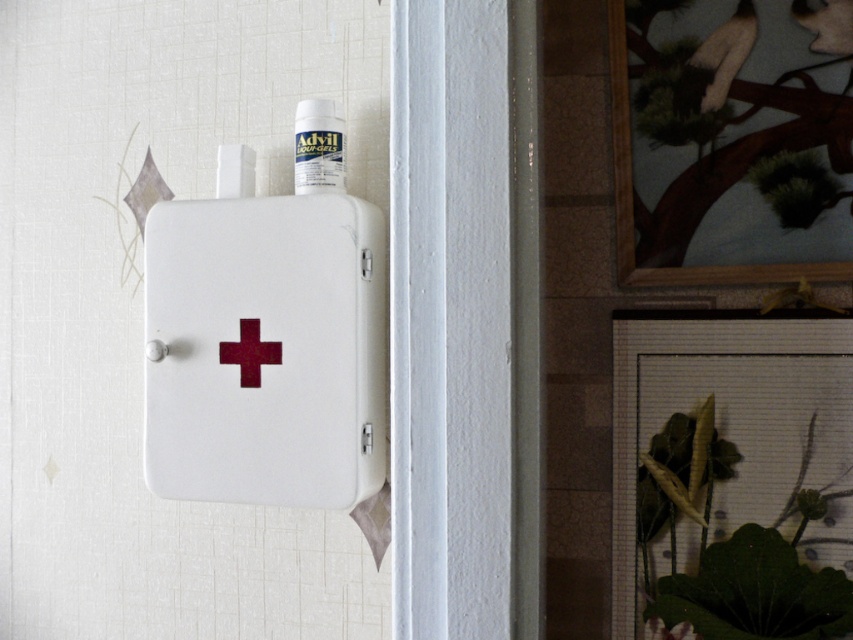
Can you confirm if white matte first aid box at center is shorter than maroon matte cross at center?

Incorrect, white matte first aid box at center's height does not fall short of maroon matte cross at center's.

This screenshot has height=640, width=853. What do you see at coordinates (265, 349) in the screenshot?
I see `white matte first aid box at center` at bounding box center [265, 349].

This screenshot has width=853, height=640. Find the location of `white matte first aid box at center`. white matte first aid box at center is located at coordinates (265, 349).

Which is in front, point (292, 492) or point (294, 131)?

Point (292, 492) is more forward.

Is point (144, 266) positioned in front of point (322, 113)?

No, it is behind (322, 113).

This screenshot has height=640, width=853. Find the location of `white matte first aid box at center`. white matte first aid box at center is located at coordinates (265, 349).

Which is in front, point (310, 102) or point (245, 387)?

Point (245, 387)

You are a GUI agent. You are given a task and a screenshot of the screen. Output one action in this format:
    pyautogui.click(x=<x>, y=<y>)
    Task: Click on the white plastic bottle at upper center
    The height and width of the screenshot is (640, 853).
    Given the screenshot: What is the action you would take?
    pyautogui.click(x=318, y=147)